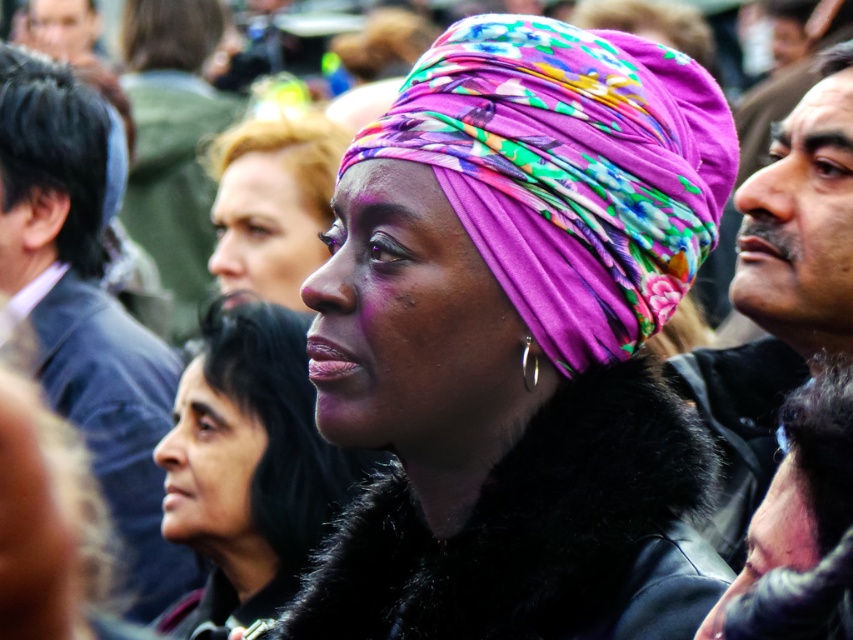
You are an artist trying to sketch this scene. You notice the smooth skin face at lower left and the floral fabric headscarf at center. Which object should you draw first to ensure proper layering?

The smooth skin face at lower left should be drawn first because it is in front of the floral fabric headscarf at center, allowing you to layer the headscarf behind it appropriately.